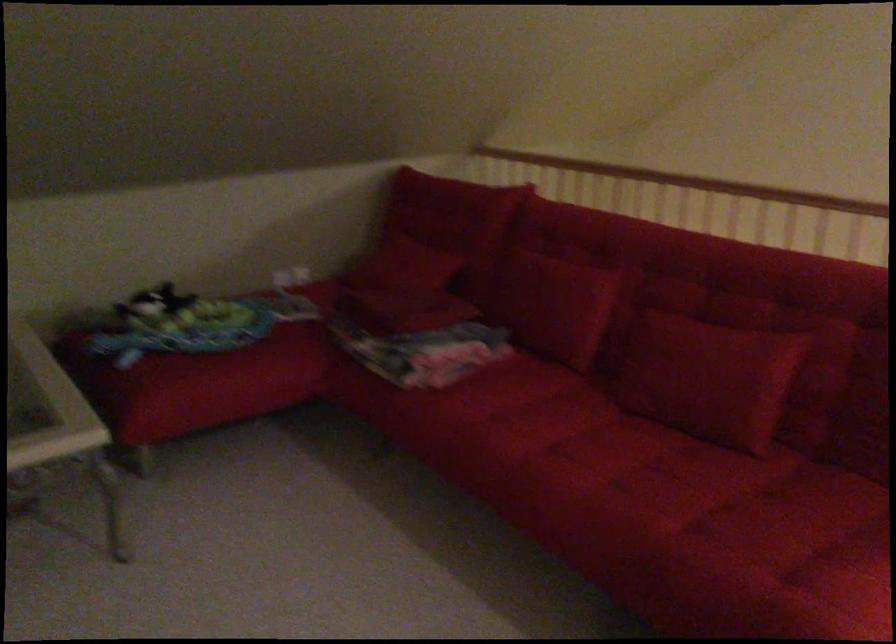
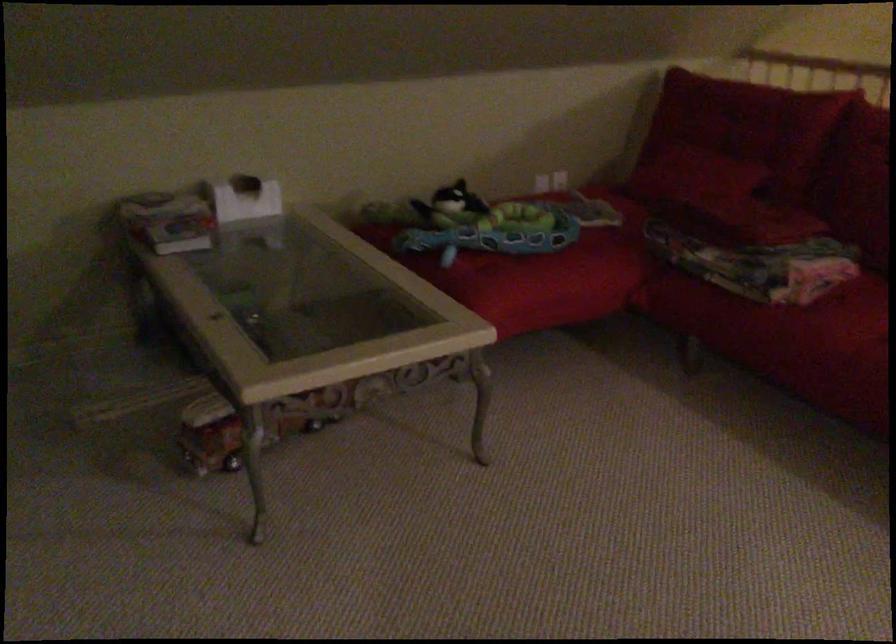
In the second image, find the point that corresponds to pixel 435 222 in the first image.

(745, 125)